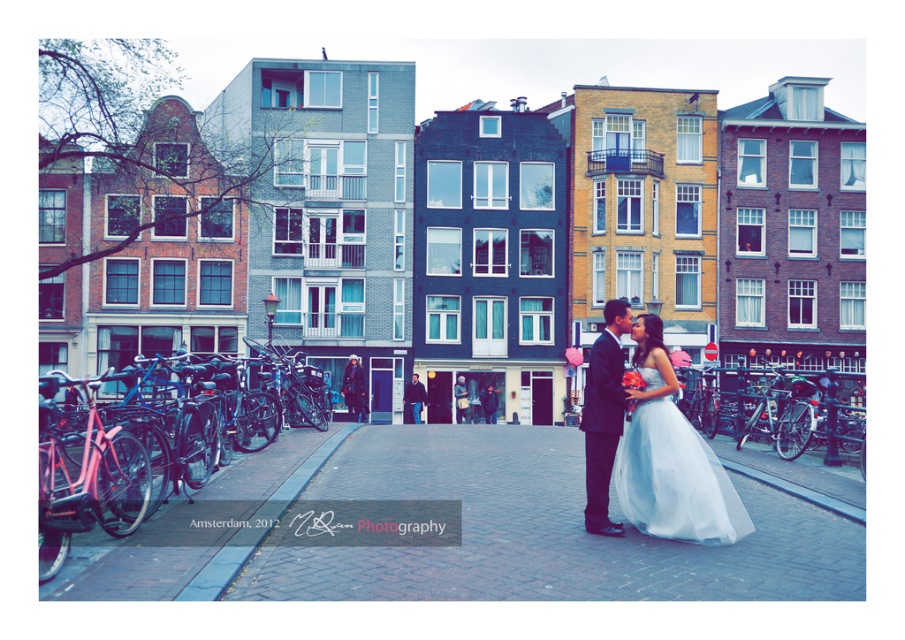
Which is above, white tulle dress at center or white satin dress at center?

white tulle dress at center is above.

Where is `white tulle dress at center`? white tulle dress at center is located at coordinates (670, 460).

Between point (742, 529) and point (594, 410), which one is positioned behind?

The point (594, 410) is behind.

Where is `white tulle dress at center`? Image resolution: width=905 pixels, height=640 pixels. white tulle dress at center is located at coordinates (670, 460).